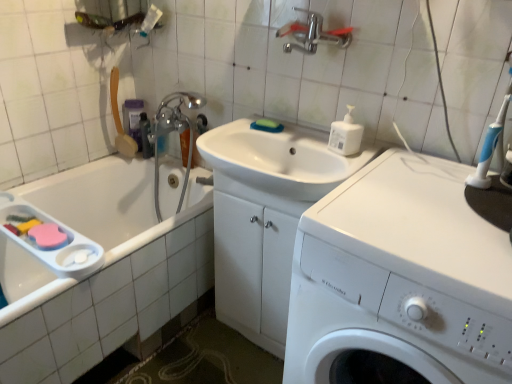
What is the approximate height of blue plastic toothbrush at upper right?

The height of blue plastic toothbrush at upper right is 9.52 inches.

Where is `white plastic washing machine at center`? The image size is (512, 384). white plastic washing machine at center is located at coordinates (400, 281).

Locate an element on the screen. This screenshot has height=384, width=512. white plastic bottle at upper right is located at coordinates pyautogui.click(x=345, y=135).

What is the approximate height of white plastic bottle at upper right?

white plastic bottle at upper right is 6.08 inches in height.

Describe the element at coordinates (145, 136) in the screenshot. I see `translucent plastic bottle at upper left, the 2th toiletry positioned from the left` at that location.

What are the coordinates of `translucent plastic shampoo bottle at upper left, the second toiletry when ordered from right to left` in the screenshot? It's located at (133, 119).

Find the location of a particular element. This screenshot has height=384, width=512. blue plastic toothbrush at upper right is located at coordinates (490, 147).

Consider the image. From the image's perspective, is translucent plastic shampoo bottle at upper left, the second toiletry when ordered from right to left, beneath white plastic washing machine at center?

No.

Is point (138, 127) positioned behind point (357, 284)?

Yes, point (138, 127) is behind point (357, 284).

In terms of size, does translucent plastic shampoo bottle at upper left, the first toiletry positioned from the left, appear bigger or smaller than white plastic washing machine at center?

Clearly, translucent plastic shampoo bottle at upper left, the first toiletry positioned from the left, is smaller in size than white plastic washing machine at center.

Which is in front, translucent plastic shampoo bottle at upper left, the second toiletry when ordered from right to left, or white plastic washing machine at center?

white plastic washing machine at center is closer to the camera.

Is blue plastic toothbrush at upper right facing towards white plastic bottle at upper right?

No, blue plastic toothbrush at upper right does not turn towards white plastic bottle at upper right.

From the image's perspective, between blue plastic toothbrush at upper right and white plastic bottle at upper right, who is located below?

blue plastic toothbrush at upper right appears lower in the image.

Considering the positions of objects blue plastic toothbrush at upper right and white plastic bottle at upper right in the image provided, who is more to the right, blue plastic toothbrush at upper right or white plastic bottle at upper right?

Positioned to the right is blue plastic toothbrush at upper right.

Considering the sizes of objects green sponge at sink and polished chrome faucet at upper center in the image provided, who is taller, green sponge at sink or polished chrome faucet at upper center?

polished chrome faucet at upper center.

Is green sponge at sink next to polished chrome faucet at upper center and touching it?

No, green sponge at sink is not beside polished chrome faucet at upper center.

From a real-world perspective, is green sponge at sink above or below polished chrome faucet at upper center?

From a real-world perspective, green sponge at sink is physically below polished chrome faucet at upper center.

Based on the photo, can you tell me how much green sponge at sink and polished chrome faucet at upper center differ in facing direction?

They differ by 6.25 degrees in their facing directions.

Looking at this image, is white plastic bottle at upper right beside white glossy sink at center?

They are not placed beside each other.

Is white plastic bottle at upper right in front of white glossy sink at center?

No, white plastic bottle at upper right is further to the viewer.

From the image's perspective, which is above, white plastic bottle at upper right or white glossy sink at center?

white plastic bottle at upper right, from the image's perspective.

Can you confirm if white plastic bottle at upper right is positioned to the left of white glossy sink at center?

In fact, white plastic bottle at upper right is to the right of white glossy sink at center.

Is translucent plastic bottle at upper left, the 1th toiletry positioned from the right, looking in the opposite direction of translucent plastic shampoo bottle at upper left, the first toiletry positioned from the left?

No, translucent plastic bottle at upper left, the 1th toiletry positioned from the right, is not facing the opposite direction of translucent plastic shampoo bottle at upper left, the first toiletry positioned from the left.

How far apart are translucent plastic bottle at upper left, the 1th toiletry positioned from the right, and translucent plastic shampoo bottle at upper left, the second toiletry when ordered from right to left?

The distance of translucent plastic bottle at upper left, the 1th toiletry positioned from the right, from translucent plastic shampoo bottle at upper left, the second toiletry when ordered from right to left, is 1.49 inches.

How many degrees apart are the facing directions of translucent plastic bottle at upper left, the 1th toiletry positioned from the right, and translucent plastic shampoo bottle at upper left, the first toiletry positioned from the left?

2.82 degrees.

Looking at this image, does translucent plastic bottle at upper left, the 2th toiletry positioned from the left, appear on the right side of translucent plastic shampoo bottle at upper left, the first toiletry positioned from the left?

Yes.

Is blue plastic toothbrush at upper right not inside white glossy sink at center?

Yes, blue plastic toothbrush at upper right is located beyond the bounds of white glossy sink at center.

Which object is thinner, blue plastic toothbrush at upper right or white glossy sink at center?

With smaller width is blue plastic toothbrush at upper right.

Does blue plastic toothbrush at upper right come in front of white glossy sink at center?

Yes, it is in front of white glossy sink at center.

Between point (505, 95) and point (306, 173), which one is positioned in front?

Positioned in front is point (505, 95).

Considering the points (502, 119) and (364, 282), which point is behind, point (502, 119) or point (364, 282)?

Point (502, 119)

From a real-world perspective, relative to white plastic washing machine at center, is blue plastic toothbrush at upper right vertically above or below?

blue plastic toothbrush at upper right is above white plastic washing machine at center.

From the image's perspective, is blue plastic toothbrush at upper right located above or below white plastic washing machine at center?

blue plastic toothbrush at upper right is above white plastic washing machine at center.

Where is `washing machine that appears on the right of translucent plastic shampoo bottle at upper left, the second toiletry when ordered from right to left`? This screenshot has width=512, height=384. washing machine that appears on the right of translucent plastic shampoo bottle at upper left, the second toiletry when ordered from right to left is located at coordinates (400, 281).

You are a GUI agent. You are given a task and a screenshot of the screen. Output one action in this format:
    pyautogui.click(x=<x>, y=<y>)
    Task: Click on the toothbrush in front of the white plastic bottle at upper right
    This screenshot has width=512, height=384.
    Given the screenshot: What is the action you would take?
    pyautogui.click(x=490, y=147)

Based on their spatial positions, is white glossy sink at center or translucent plastic bottle at upper left, the 2th toiletry positioned from the left, further from white plastic washing machine at center?

translucent plastic bottle at upper left, the 2th toiletry positioned from the left, lies further to white plastic washing machine at center than the other object.

Which object lies nearer to the anchor point translucent plastic shampoo bottle at upper left, the first toiletry positioned from the left, polished chrome faucet at upper center or white plastic bottle at upper right?

polished chrome faucet at upper center lies closer to translucent plastic shampoo bottle at upper left, the first toiletry positioned from the left, than the other object.

Based on their spatial positions, is translucent plastic shampoo bottle at upper left, the first toiletry positioned from the left, or translucent plastic bottle at upper left, the 1th toiletry positioned from the right, closer to blue plastic toothbrush at upper right?

translucent plastic bottle at upper left, the 1th toiletry positioned from the right, is positioned closer to the anchor blue plastic toothbrush at upper right.

Looking at the image, which one is located closer to translucent plastic shampoo bottle at upper left, the first toiletry positioned from the left, blue plastic toothbrush at upper right or green sponge at sink?

green sponge at sink.

Estimate the real-world distances between objects in this image. Which object is further from white plastic washing machine at center, translucent plastic shampoo bottle at upper left, the first toiletry positioned from the left, or white plastic bottle at upper right?

translucent plastic shampoo bottle at upper left, the first toiletry positioned from the left, lies further to white plastic washing machine at center than the other object.

Based on their spatial positions, is translucent plastic shampoo bottle at upper left, the first toiletry positioned from the left, or white plastic bottle at upper right closer to white glossy sink at center?

Among the two, white plastic bottle at upper right is located nearer to white glossy sink at center.

When comparing their distances from white glossy sink at center, does green sponge at sink or blue plastic toothbrush at upper right seem closer?

The object closer to white glossy sink at center is green sponge at sink.

Based on their spatial positions, is green sponge at sink or blue plastic toothbrush at upper right closer to white plastic bottle at upper right?

green sponge at sink lies closer to white plastic bottle at upper right than the other object.

At what (x,y) coordinates should I click in order to perform the action: click on cleaning product between green sponge at sink and blue plastic toothbrush at upper right. Please return your answer as a coordinate pair (x, y). The height and width of the screenshot is (384, 512). Looking at the image, I should click on (345, 135).

In order to click on toothbrush between white plastic washing machine at center and translucent plastic shampoo bottle at upper left, the first toiletry positioned from the left, along the z-axis in this screenshot , I will do `click(490, 147)`.

Locate an element on the screen. Image resolution: width=512 pixels, height=384 pixels. soap located between translucent plastic bottle at upper left, the 2th toiletry positioned from the left, and white plastic bottle at upper right in the left-right direction is located at coordinates (267, 124).

You are a GUI agent. You are given a task and a screenshot of the screen. Output one action in this format:
    pyautogui.click(x=<x>, y=<y>)
    Task: Click on the toothbrush located between white plastic washing machine at center and translucent plastic bottle at upper left, the 2th toiletry positioned from the left, in the depth direction
    The height and width of the screenshot is (384, 512).
    Given the screenshot: What is the action you would take?
    (x=490, y=147)